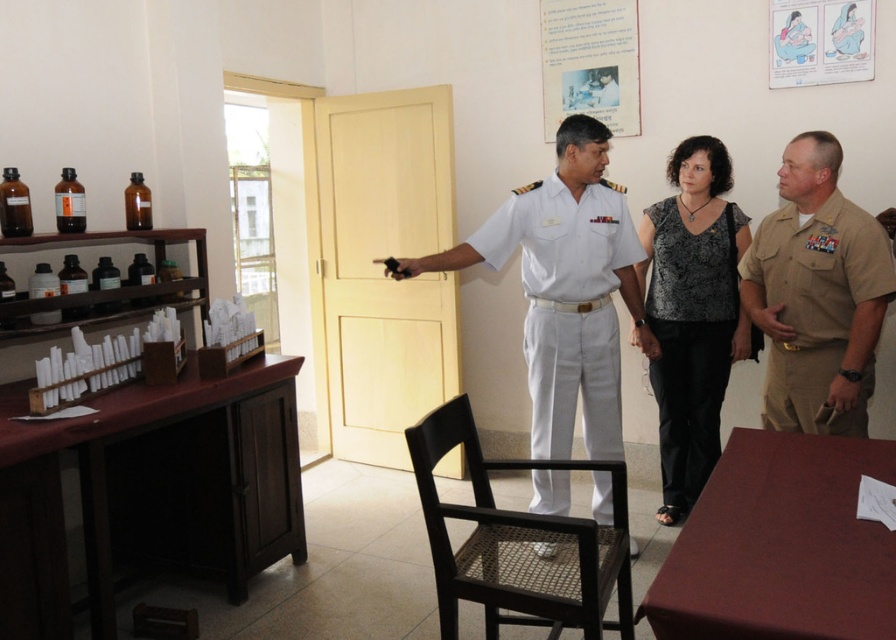
Question: Which point is closer to the camera?

Choices:
 (A) (425, 483)
 (B) (808, 257)
 (C) (584, 339)

Answer: (A)

Question: Which is nearer to the white cotton uniform at center?

Choices:
 (A) tan uniform shirt at right
 (B) black woven wood chair at center
 (C) brown wood table at lower left
 (D) burgundy fabric table at lower right

Answer: (A)

Question: Which object is the closest to the tan uniform shirt at right?

Choices:
 (A) white cotton uniform at center
 (B) black woven wood chair at center
 (C) black sheer blouse at center

Answer: (C)

Question: Can you confirm if tan uniform shirt at right is positioned above black woven wood chair at center?

Choices:
 (A) no
 (B) yes

Answer: (B)

Question: Does burgundy fabric table at lower right have a smaller size compared to black sheer blouse at center?

Choices:
 (A) no
 (B) yes

Answer: (B)

Question: Does tan uniform shirt at right appear on the left side of white cotton uniform at center?

Choices:
 (A) yes
 (B) no

Answer: (B)